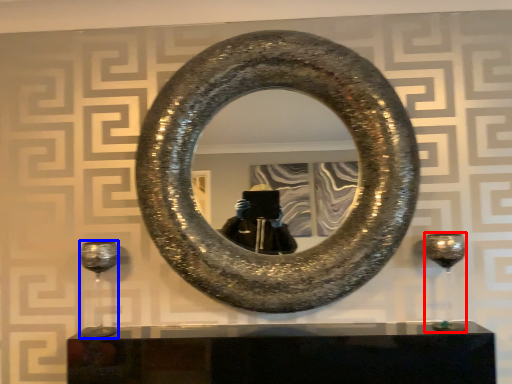
Question: Among these objects, which one is farthest to the camera, wine glass (highlighted by a red box) or wine glass (highlighted by a blue box)?

Choices:
 (A) wine glass
 (B) wine glass

Answer: (B)